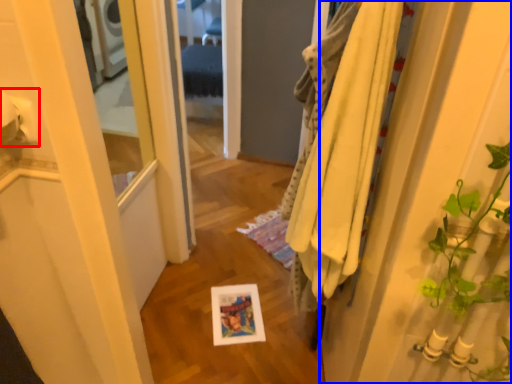
Question: Which object appears farthest to the camera in this image, toilet paper (highlighted by a red box) or door (highlighted by a blue box)?

Choices:
 (A) toilet paper
 (B) door

Answer: (A)